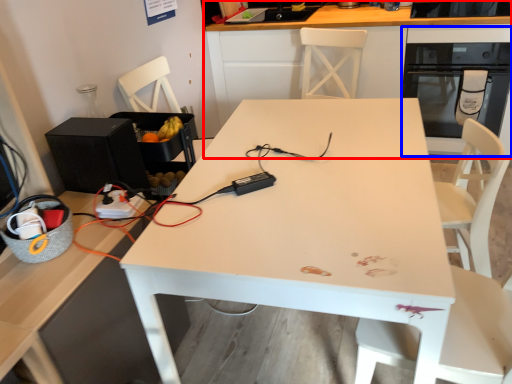
Question: Which object appears farthest to the camera in this image, cabinetry (highlighted by a red box) or oven (highlighted by a blue box)?

Choices:
 (A) cabinetry
 (B) oven

Answer: (B)